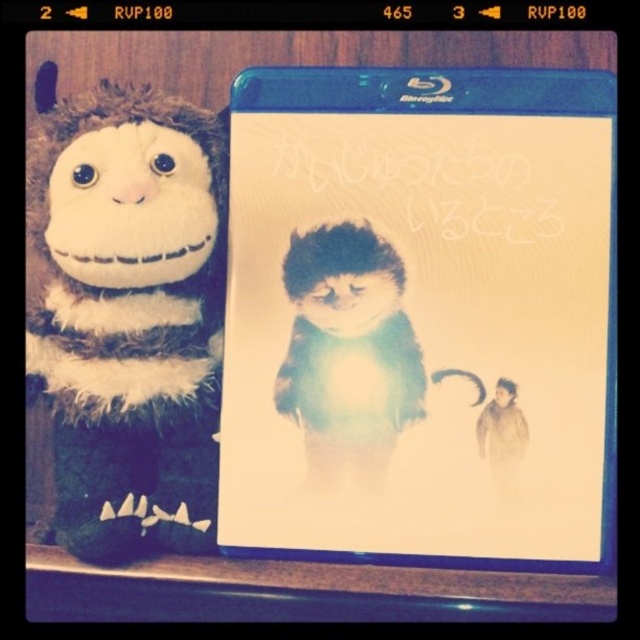
You are organizing a shelf and want to place the blue plastic dvd case at center and the fuzzy brown plush monkey at left. According to the image, which object is positioned lower on the shelf?

The blue plastic dvd case at center is positioned lower than the fuzzy brown plush monkey at left, so it is the lower object.

You are organizing a shelf and see the fuzzy brown plush monkey at left and the blue plastic dvd case at center. Which object is closer to you?

The blue plastic dvd case at center is closer to you because the fuzzy brown plush monkey at left is behind it.